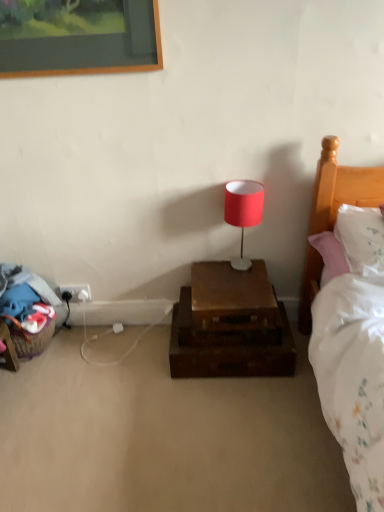
Where is `wooden suitcase at center`? wooden suitcase at center is located at coordinates (230, 325).

Describe the element at coordinates (230, 325) in the screenshot. I see `wooden suitcase at center` at that location.

The height and width of the screenshot is (512, 384). Describe the element at coordinates (76, 292) in the screenshot. I see `white plastic electrical outlet at lower left` at that location.

What do you see at coordinates (361, 239) in the screenshot? I see `white soft pillow at right` at bounding box center [361, 239].

At what (x,y) coordinates should I click in order to perform the action: click on wooden suitcase at center. Please return your answer as a coordinate pair (x, y). Image resolution: width=384 pixels, height=512 pixels. Looking at the image, I should click on (230, 325).

From the picture: From a real-world perspective, which object rests below the other?

In real-world perspective, white plastic electrical outlet at lower left is lower.

Can you confirm if matte red lampshade at center is positioned to the left of white plastic electrical outlet at lower left?

No.

Is matte red lampshade at center directly adjacent to white plastic electrical outlet at lower left?

No, matte red lampshade at center is not with white plastic electrical outlet at lower left.

What's the angular difference between matte red lampshade at center and white plastic electrical outlet at lower left's facing directions?

0.0231 degrees.

Is wooden suitcase at center turned away from white soft pillow at right?

No, wooden suitcase at center's orientation is not away from white soft pillow at right.

How different are the orientations of wooden suitcase at center and white soft pillow at right in degrees?

The angular difference between wooden suitcase at center and white soft pillow at right is 1.13 degrees.

The image size is (384, 512). I want to click on pillow lying above the wooden suitcase at center (from the image's perspective), so click(361, 239).

Is wooden suitcase at center closer to camera compared to white soft pillow at right?

That is False.

Would you say matte red lampshade at center is inside or outside white soft pillow at right?

The correct answer is: outside.

Is matte red lampshade at center far away from white soft pillow at right?

matte red lampshade at center is near white soft pillow at right, not far away.

From a real-world perspective, relative to white soft pillow at right, is matte red lampshade at center vertically above or below?

matte red lampshade at center is below white soft pillow at right.

Is matte red lampshade at center bigger or smaller than white soft pillow at right?

In the image, matte red lampshade at center appears to be smaller than white soft pillow at right.

Between white soft pillow at right and white plastic electrical outlet at lower left, which one has larger size?

white soft pillow at right.

Which is farther, (383, 233) or (80, 297)?

The point (80, 297) is farther from the camera.

Is white soft pillow at right outside of white plastic electrical outlet at lower left?

Yes, white soft pillow at right is not within white plastic electrical outlet at lower left.

Is white soft pillow at right taller than white plastic electrical outlet at lower left?

Yes, white soft pillow at right is taller than white plastic electrical outlet at lower left.

Which object is further away from the camera taking this photo, wooden suitcase at center or white plastic electrical outlet at lower left?

white plastic electrical outlet at lower left is behind.

Is wooden suitcase at center oriented away from white plastic electrical outlet at lower left?

No, wooden suitcase at center is not facing the opposite direction of white plastic electrical outlet at lower left.

How distant is wooden suitcase at center from white plastic electrical outlet at lower left?

wooden suitcase at center is 29.66 inches from white plastic electrical outlet at lower left.

Consider the image. From a real-world perspective, which is physically below, wooden suitcase at center or white plastic electrical outlet at lower left?

wooden suitcase at center, from a real-world perspective.

Is matte red lampshade at center inside white soft pillow at right?

No, matte red lampshade at center is not inside white soft pillow at right.

Could you tell me if white soft pillow at right is turned towards matte red lampshade at center?

No.

From the image's perspective, is white soft pillow at right beneath matte red lampshade at center?

Indeed, from the image's perspective, white soft pillow at right is shown beneath matte red lampshade at center.

Based on the photo, is wooden suitcase at center located outside matte red lampshade at center?

That's correct, wooden suitcase at center is outside of matte red lampshade at center.

Between point (228, 298) and point (231, 263), which one is positioned in front?

Point (228, 298)

Which object is positioned more to the left, wooden suitcase at center or matte red lampshade at center?

From the viewer's perspective, wooden suitcase at center appears more on the left side.

Is wooden suitcase at center smaller than matte red lampshade at center?

No, wooden suitcase at center is not smaller than matte red lampshade at center.

Image resolution: width=384 pixels, height=512 pixels. What are the coordinates of `electric outlet lying on the left of matte red lampshade at center` in the screenshot? It's located at (76, 292).

Where is `pillow that appears in front of the wooden suitcase at center`? The image size is (384, 512). pillow that appears in front of the wooden suitcase at center is located at coordinates (361, 239).

When comparing their distances from matte red lampshade at center, does white soft pillow at right or white plastic electrical outlet at lower left seem further?

white plastic electrical outlet at lower left is further to matte red lampshade at center.

Estimate the real-world distances between objects in this image. Which object is closer to white soft pillow at right, matte red lampshade at center or white plastic electrical outlet at lower left?

matte red lampshade at center.

When comparing their distances from white soft pillow at right, does matte red lampshade at center or wooden suitcase at center seem further?

Based on the image, wooden suitcase at center appears to be further to white soft pillow at right.

Based on their spatial positions, is white soft pillow at right or matte red lampshade at center closer to white plastic electrical outlet at lower left?

matte red lampshade at center is closer to white plastic electrical outlet at lower left.

Estimate the real-world distances between objects in this image. Which object is further from wooden suitcase at center, white plastic electrical outlet at lower left or white soft pillow at right?

Among the two, white plastic electrical outlet at lower left is located further to wooden suitcase at center.

Estimate the real-world distances between objects in this image. Which object is closer to white soft pillow at right, white plastic electrical outlet at lower left or wooden suitcase at center?

wooden suitcase at center is closer to white soft pillow at right.

Looking at the image, which one is located further to white soft pillow at right, white plastic electrical outlet at lower left or matte red lampshade at center?

The object further to white soft pillow at right is white plastic electrical outlet at lower left.

Considering their positions, is matte red lampshade at center positioned further to wooden suitcase at center than white soft pillow at right?

white soft pillow at right is further to wooden suitcase at center.

Identify the location of table lamp situated between wooden suitcase at center and white soft pillow at right from left to right. The width and height of the screenshot is (384, 512). (243, 212).

You are a GUI agent. You are given a task and a screenshot of the screen. Output one action in this format:
    pyautogui.click(x=<x>, y=<y>)
    Task: Click on the nightstand between white plastic electrical outlet at lower left and white soft pillow at right from left to right
    The image size is (384, 512).
    Given the screenshot: What is the action you would take?
    pyautogui.click(x=230, y=325)

Locate an element on the screen. table lamp between white plastic electrical outlet at lower left and white soft pillow at right in the horizontal direction is located at coordinates (243, 212).

I want to click on nightstand between white plastic electrical outlet at lower left and matte red lampshade at center in the horizontal direction, so click(230, 325).